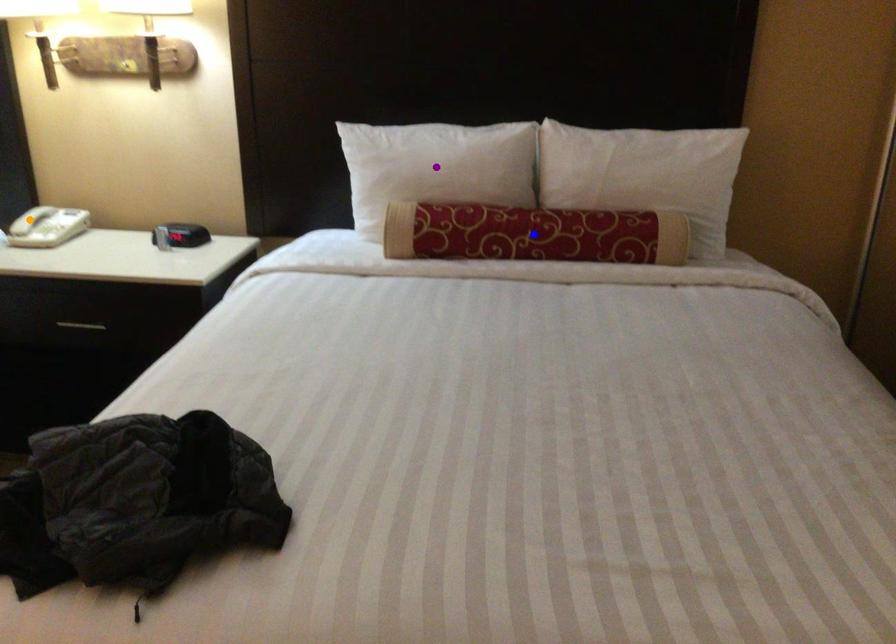
Order these from farthest to nearest:
orange point, blue point, purple point

1. orange point
2. purple point
3. blue point